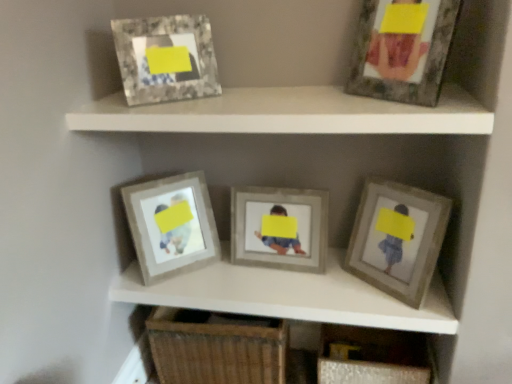
The image size is (512, 384). I want to click on vacant region below matte gray frame at upper center (from a real-world perspective), so click(x=267, y=284).